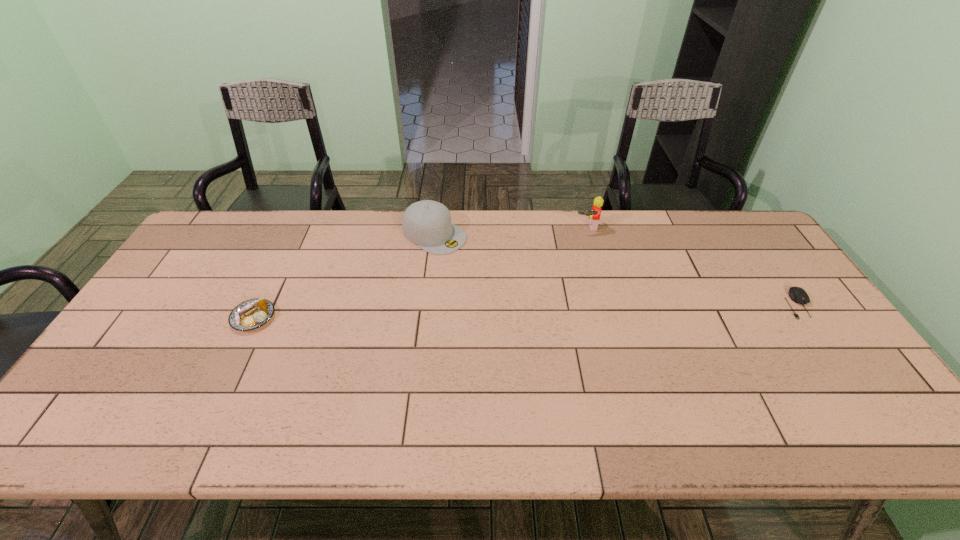
Where is `vacant spot on the desktop that is between the leftmost object and the shortest object and is positioned in front of the tallest object with the accessory visible`? vacant spot on the desktop that is between the leftmost object and the shortest object and is positioned in front of the tallest object with the accessory visible is located at coordinates (603, 308).

Where is `free space on the desktop that is between the second shortest object and the mouse and is positioned on the front-facing side of the third shortest object`? The image size is (960, 540). free space on the desktop that is between the second shortest object and the mouse and is positioned on the front-facing side of the third shortest object is located at coordinates (558, 310).